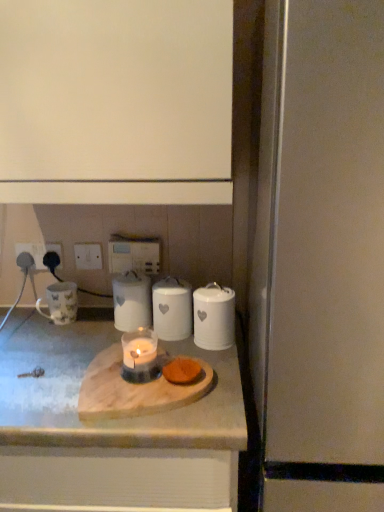
At what (x,y) coordinates should I click in order to perform the action: click on vacant space to the left of white ceramic candle at center, which appears as the 4th appliance when viewed from the right. Please return your answer as a coordinate pair (x, y). Looking at the image, I should click on (77, 331).